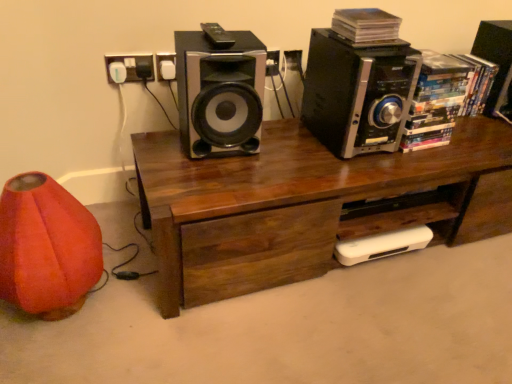
What is the approximate height of metallic silver speaker at center, which is counted as the 1th speaker, starting from the left?

It is 12.35 inches.

In order to click on metallic silver speaker at center, which is counted as the 1th speaker, starting from the left in this screenshot , I will do `click(220, 93)`.

Describe the element at coordinates (496, 59) in the screenshot. I see `black plastic speaker at upper right, which is the third speaker in left-to-right order` at that location.

At what (x,y) coordinates should I click in order to perform the action: click on wooden desk at center. Please return your answer as a coordinate pair (x, y). Looking at the image, I should click on (304, 205).

Find the location of a particular element. black metallic speaker at upper right, which is counted as the second speaker, starting from the left is located at coordinates (358, 93).

Is black plastic speaker at upper right, the 1th speaker from the right, located within black plastic remote control at upper center?

No.

Between black plastic remote control at upper center and black plastic speaker at upper right, the 1th speaker from the right, which one has smaller size?

A: black plastic remote control at upper center.

Based on the photo, is black plastic remote control at upper center closer to the viewer compared to black plastic speaker at upper right, which is the third speaker in left-to-right order?

That is True.

Who is shorter, black plastic remote control at upper center or black plastic speaker at upper right, which is the third speaker in left-to-right order?

black plastic remote control at upper center.

From a real-world perspective, is black metallic speaker at upper right, acting as the 2th speaker starting from the right, physically located above or below orange fabric bean bag chair at lower left?

In terms of real-world spatial position, black metallic speaker at upper right, acting as the 2th speaker starting from the right, is above orange fabric bean bag chair at lower left.

Consider the image. Is the surface of black metallic speaker at upper right, acting as the 2th speaker starting from the right, in direct contact with orange fabric bean bag chair at lower left?

No, black metallic speaker at upper right, acting as the 2th speaker starting from the right, is not with orange fabric bean bag chair at lower left.

Is black metallic speaker at upper right, acting as the 2th speaker starting from the right, thinner than orange fabric bean bag chair at lower left?

No, black metallic speaker at upper right, acting as the 2th speaker starting from the right, is not thinner than orange fabric bean bag chair at lower left.

Would you say orange fabric bean bag chair at lower left is part of wooden desk at center's contents?

No.

Between wooden desk at center and orange fabric bean bag chair at lower left, which one has smaller width?

orange fabric bean bag chair at lower left is thinner.

Is wooden desk at center smaller than orange fabric bean bag chair at lower left?

Incorrect, wooden desk at center is not smaller in size than orange fabric bean bag chair at lower left.

Which point is more distant from viewer, (332, 260) or (32, 236)?

The point (332, 260) is behind.

Can you confirm if black plastic speaker at upper right, the 1th speaker from the right, is wider than white plastic socket at upper left?

Correct, the width of black plastic speaker at upper right, the 1th speaker from the right, exceeds that of white plastic socket at upper left.

Considering the positions of objects black plastic speaker at upper right, which is the third speaker in left-to-right order, and white plastic socket at upper left in the image provided, who is in front, black plastic speaker at upper right, which is the third speaker in left-to-right order, or white plastic socket at upper left?

white plastic socket at upper left.

Looking at this image, from the image's perspective, which object appears higher, black metallic speaker at upper right, which is counted as the second speaker, starting from the left, or black plastic speaker at upper right, which is the third speaker in left-to-right order?

From the image's view, black plastic speaker at upper right, which is the third speaker in left-to-right order, is above.

From the picture: Would you say black plastic speaker at upper right, which is the third speaker in left-to-right order, is part of black metallic speaker at upper right, which is counted as the second speaker, starting from the left,'s contents?

No, black metallic speaker at upper right, which is counted as the second speaker, starting from the left, does not contain black plastic speaker at upper right, which is the third speaker in left-to-right order.

Based on their sizes in the image, would you say black metallic speaker at upper right, which is counted as the second speaker, starting from the left, is bigger or smaller than black plastic speaker at upper right, which is the third speaker in left-to-right order?

black metallic speaker at upper right, which is counted as the second speaker, starting from the left, is bigger than black plastic speaker at upper right, which is the third speaker in left-to-right order.

Which object is thinner, black metallic speaker at upper right, which is counted as the second speaker, starting from the left, or black plastic speaker at upper right, the 1th speaker from the right?

black plastic speaker at upper right, the 1th speaker from the right, is thinner.

Considering the relative sizes of black metallic speaker at upper right, which is counted as the second speaker, starting from the left, and wooden desk at center in the image provided, is black metallic speaker at upper right, which is counted as the second speaker, starting from the left, taller than wooden desk at center?

No.

Does black metallic speaker at upper right, acting as the 2th speaker starting from the right, come behind wooden desk at center?

Yes, black metallic speaker at upper right, acting as the 2th speaker starting from the right, is further from the camera.

Is black metallic speaker at upper right, acting as the 2th speaker starting from the right, positioned far away from wooden desk at center?

No, black metallic speaker at upper right, acting as the 2th speaker starting from the right, is not far from wooden desk at center.

Which is less distant, [336,147] or [451,221]?

Point [336,147] is closer to the camera than point [451,221].

Which is behind, white plastic socket at upper left or orange fabric bean bag chair at lower left?

white plastic socket at upper left.

Which of these two, white plastic socket at upper left or orange fabric bean bag chair at lower left, is bigger?

With larger size is orange fabric bean bag chair at lower left.

Does white plastic socket at upper left touch orange fabric bean bag chair at lower left?

No, white plastic socket at upper left is not touching orange fabric bean bag chair at lower left.

In order to click on the 1st speaker directly beneath the black plastic remote control at upper center (from a real-world perspective) in this screenshot , I will do `click(496, 59)`.

Where is `the 2nd speaker to the right of the orange fabric bean bag chair at lower left, counting from the anchor's position`? the 2nd speaker to the right of the orange fabric bean bag chair at lower left, counting from the anchor's position is located at coordinates tap(358, 93).

Looking at the image, which one is located closer to metallic silver speaker at center, which is counted as the 1th speaker, starting from the left, wooden desk at center or black metallic speaker at upper right, which is counted as the second speaker, starting from the left?

wooden desk at center.

Considering their positions, is metallic silver speaker at center, which is counted as the 1th speaker, starting from the left, positioned further to orange fabric bean bag chair at lower left than black plastic remote control at upper center?

black plastic remote control at upper center.

Considering their positions, is orange fabric bean bag chair at lower left positioned further to white plastic socket at upper left than black plastic speaker at upper right, which is the third speaker in left-to-right order?

The object further to white plastic socket at upper left is black plastic speaker at upper right, which is the third speaker in left-to-right order.

Which object lies further to the anchor point white plastic socket at upper left, black plastic speaker at upper right, which is the third speaker in left-to-right order, or wooden desk at center?

black plastic speaker at upper right, which is the third speaker in left-to-right order, is positioned further to the anchor white plastic socket at upper left.

Estimate the real-world distances between objects in this image. Which object is closer to white plastic socket at upper left, black metallic speaker at upper right, which is counted as the second speaker, starting from the left, or orange fabric bean bag chair at lower left?

orange fabric bean bag chair at lower left is closer to white plastic socket at upper left.

From the image, which object appears to be farther from black metallic speaker at upper right, which is counted as the second speaker, starting from the left, black plastic speaker at upper right, the 1th speaker from the right, or black plastic remote control at upper center?

Among the two, black plastic speaker at upper right, the 1th speaker from the right, is located further to black metallic speaker at upper right, which is counted as the second speaker, starting from the left.

Consider the image. Which object lies nearer to the anchor point white plastic socket at upper left, metallic silver speaker at center, which ranks as the 3th speaker in right-to-left order, or black metallic speaker at upper right, which is counted as the second speaker, starting from the left?

Based on the image, metallic silver speaker at center, which ranks as the 3th speaker in right-to-left order, appears to be nearer to white plastic socket at upper left.

Estimate the real-world distances between objects in this image. Which object is further from orange fabric bean bag chair at lower left, white plastic socket at upper left or black plastic remote control at upper center?

black plastic remote control at upper center.

Locate an element on the screen. This screenshot has height=384, width=512. desk situated between orange fabric bean bag chair at lower left and black plastic speaker at upper right, which is the third speaker in left-to-right order, from left to right is located at coordinates (304, 205).

The image size is (512, 384). Identify the location of ipod situated between white plastic socket at upper left and black plastic speaker at upper right, which is the third speaker in left-to-right order, from left to right. (217, 36).

Identify the location of speaker situated between black plastic remote control at upper center and black plastic speaker at upper right, the 1th speaker from the right, from left to right. (358, 93).

I want to click on ipod located between orange fabric bean bag chair at lower left and wooden desk at center in the left-right direction, so point(217,36).